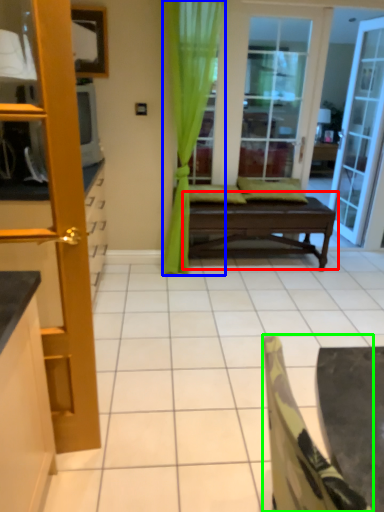
Question: Estimate the real-world distances between objects in this image. Which object is closer to table (highlighted by a red box), curtain (highlighted by a blue box) or chair (highlighted by a green box)?

Choices:
 (A) curtain
 (B) chair

Answer: (A)